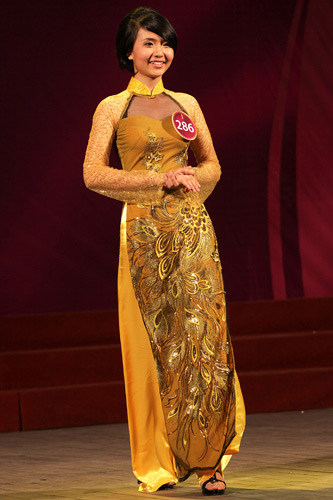
Locate an element on the screen. The width and height of the screenshot is (333, 500). stair edge is located at coordinates (92, 384), (79, 348), (67, 314).